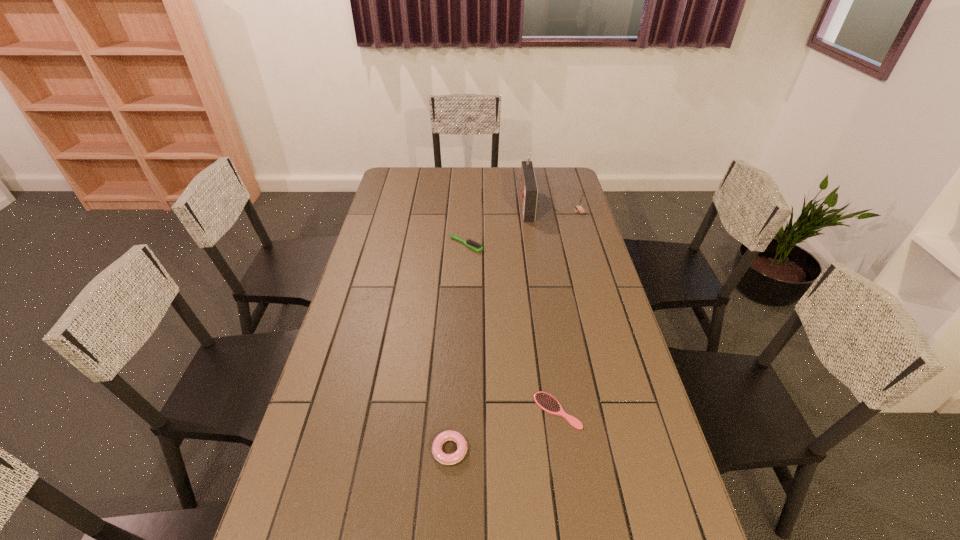
This screenshot has width=960, height=540. Identify the location of free spot between the shortest object and the left hairbrush. (x=512, y=328).

Identify which object is the fourth nearest to the shorter hairbrush. Please provide its 2D coordinates. Your answer should be formatted as a tuple, i.e. [(x, y)], where the tuple contains the x and y coordinates of a point satisfying the conditions above.

[(579, 207)]

You are a GUI agent. You are given a task and a screenshot of the screen. Output one action in this format:
    pyautogui.click(x=<x>, y=<y>)
    Task: Click on the object that is the closest to the nearest object
    The width and height of the screenshot is (960, 540).
    Given the screenshot: What is the action you would take?
    pyautogui.click(x=545, y=401)

You are a GUI agent. You are given a task and a screenshot of the screen. Output one action in this format:
    pyautogui.click(x=<x>, y=<y>)
    Task: Click on the vacant position in the image that satisfies the following two spatial constraints: 1. on the front panel of the radio receiver; 2. on the right side of the rightmost object
    The width and height of the screenshot is (960, 540).
    Given the screenshot: What is the action you would take?
    pyautogui.click(x=527, y=211)

In order to click on free spot that satisfies the following two spatial constraints: 1. on the back side of the doughnut; 2. on the right side of the taller hairbrush in this screenshot , I will do `click(461, 245)`.

This screenshot has width=960, height=540. What are the coordinates of `free spot that satisfies the following two spatial constraints: 1. on the front panel of the radio receiver; 2. on the right side of the shortest object` in the screenshot? It's located at (556, 410).

Where is `free spot that satisfies the following two spatial constraints: 1. on the back side of the doughnut; 2. on the left side of the shorter hairbrush`? The width and height of the screenshot is (960, 540). free spot that satisfies the following two spatial constraints: 1. on the back side of the doughnut; 2. on the left side of the shorter hairbrush is located at coordinates (452, 410).

You are a GUI agent. You are given a task and a screenshot of the screen. Output one action in this format:
    pyautogui.click(x=<x>, y=<y>)
    Task: Click on the free location that satisfies the following two spatial constraints: 1. on the front panel of the tallest object; 2. on the left side of the matchbox
    Image resolution: width=960 pixels, height=540 pixels.
    Given the screenshot: What is the action you would take?
    pyautogui.click(x=527, y=211)

Locate an element on the screen. This screenshot has height=540, width=960. free spot that satisfies the following two spatial constraints: 1. on the back side of the shorter hairbrush; 2. on the front panel of the radio receiver is located at coordinates (527, 205).

Locate an element on the screen. This screenshot has height=540, width=960. blank space that satisfies the following two spatial constraints: 1. on the back side of the shortest object; 2. on the front panel of the tallest object is located at coordinates (527, 205).